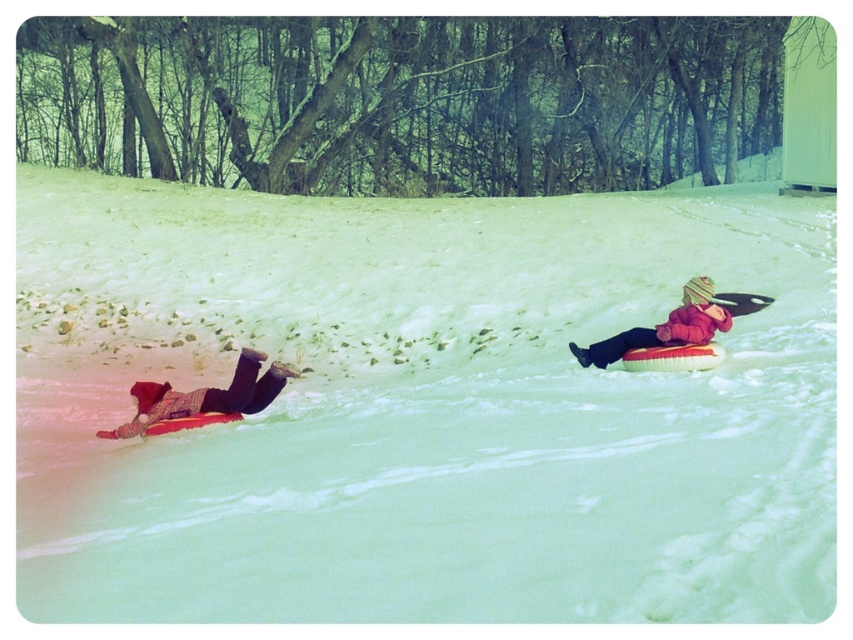
Is point (387, 396) in front of point (247, 397)?

No, (387, 396) is further to viewer.

Measure the distance between white fluffy snow at center and camera.

15.02 feet

Identify the location of white fluffy snow at center. Image resolution: width=853 pixels, height=640 pixels. (421, 408).

Between plaid fabric snowsuit at lower left and red fuzzy winter hat at upper right, which one appears on the left side from the viewer's perspective?

plaid fabric snowsuit at lower left

Does plaid fabric snowsuit at lower left have a greater width compared to red fuzzy winter hat at upper right?

Yes, plaid fabric snowsuit at lower left is wider than red fuzzy winter hat at upper right.

Which is in front, point (165, 426) or point (682, 330)?

Positioned in front is point (165, 426).

The width and height of the screenshot is (853, 640). In order to click on plaid fabric snowsuit at lower left in this screenshot , I will do `click(204, 400)`.

Can you confirm if white fluffy snow at center is taller than red fuzzy winter hat at upper right?

Indeed, white fluffy snow at center has a greater height compared to red fuzzy winter hat at upper right.

In order to click on white fluffy snow at center in this screenshot , I will do (x=421, y=408).

Is point (607, 518) less distant than point (647, 342)?

Yes, point (607, 518) is closer to viewer.

Locate an element on the screen. white fluffy snow at center is located at coordinates (421, 408).